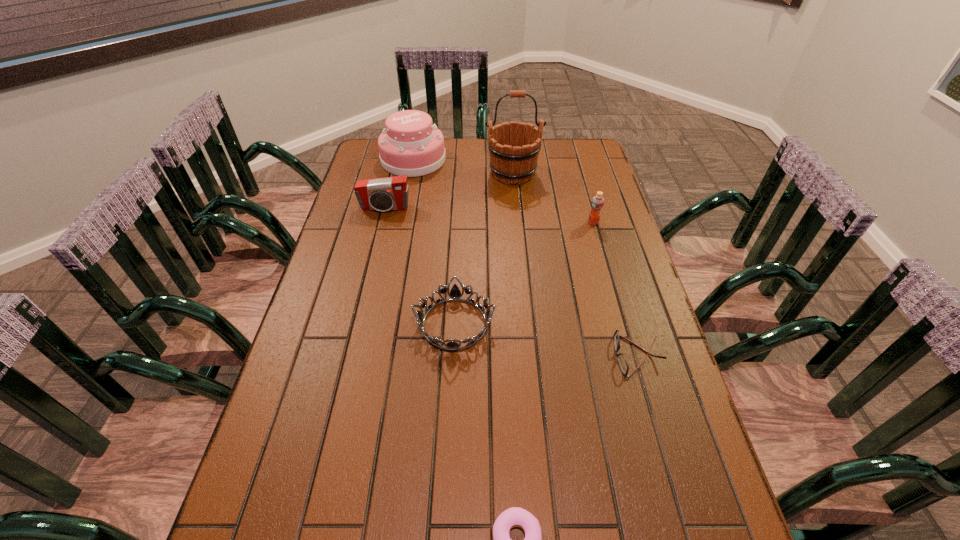
Locate an element on the screen. This screenshot has height=540, width=960. vacant region located on the front-facing side of the tiara is located at coordinates (548, 324).

Find the location of a particular element. The height and width of the screenshot is (540, 960). vacant point located 0.200m on the front-facing side of the second shortest object is located at coordinates (534, 356).

You are a GUI agent. You are given a task and a screenshot of the screen. Output one action in this format:
    pyautogui.click(x=<x>, y=<y>)
    Task: Click on the free location located 0.380m on the front-facing side of the second shortest object
    The image size is (960, 540).
    Given the screenshot: What is the action you would take?
    pyautogui.click(x=462, y=356)

I want to click on free space located 0.280m on the front-facing side of the second shortest object, so click(x=502, y=356).

The width and height of the screenshot is (960, 540). Find the location of `wine bucket present at the far edge`. wine bucket present at the far edge is located at coordinates (513, 159).

This screenshot has height=540, width=960. Identify the location of birthday cake that is at the far edge. (411, 145).

You are a GUI agent. You are given a task and a screenshot of the screen. Output one action in this format:
    pyautogui.click(x=<x>, y=<y>)
    Task: Click on the birthday cake located at the left edge
    
    Given the screenshot: What is the action you would take?
    pyautogui.click(x=411, y=145)

Identify the location of camera located in the left edge section of the desktop. The height and width of the screenshot is (540, 960). (389, 193).

Locate an element on the screen. orange juice at the right edge is located at coordinates (597, 203).

Find the location of `spectacles that is at the right edge`. spectacles that is at the right edge is located at coordinates (621, 359).